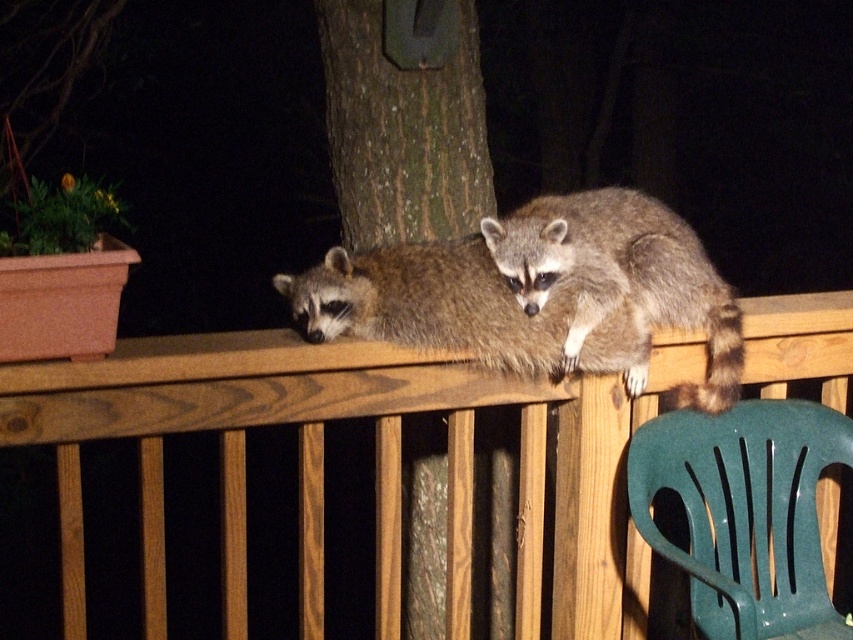
Question: Which point is farther to the camera?

Choices:
 (A) (801, 589)
 (B) (640, 595)
 (C) (474, 308)
 (D) (361, 120)

Answer: (D)

Question: Which point is closer to the camera?

Choices:
 (A) green plastic chair at lower right
 (B) wooden rail at upper center
 (C) fuzzy brown raccoon at upper center

Answer: (B)

Question: Does green plastic chair at lower right lie behind fuzzy brown raccoon at upper center?

Choices:
 (A) yes
 (B) no

Answer: (B)

Question: Which object is positioned closest to the wooden rail at upper center?

Choices:
 (A) fuzzy brown raccoon at upper center
 (B) fuzzy brown raccoon at upper right
 (C) green plastic chair at lower right

Answer: (A)

Question: Is brown rough bark tree at center wider than fuzzy brown raccoon at upper right?

Choices:
 (A) no
 (B) yes

Answer: (A)

Question: Can you confirm if wooden rail at upper center is thinner than brown rough bark tree at center?

Choices:
 (A) no
 (B) yes

Answer: (A)